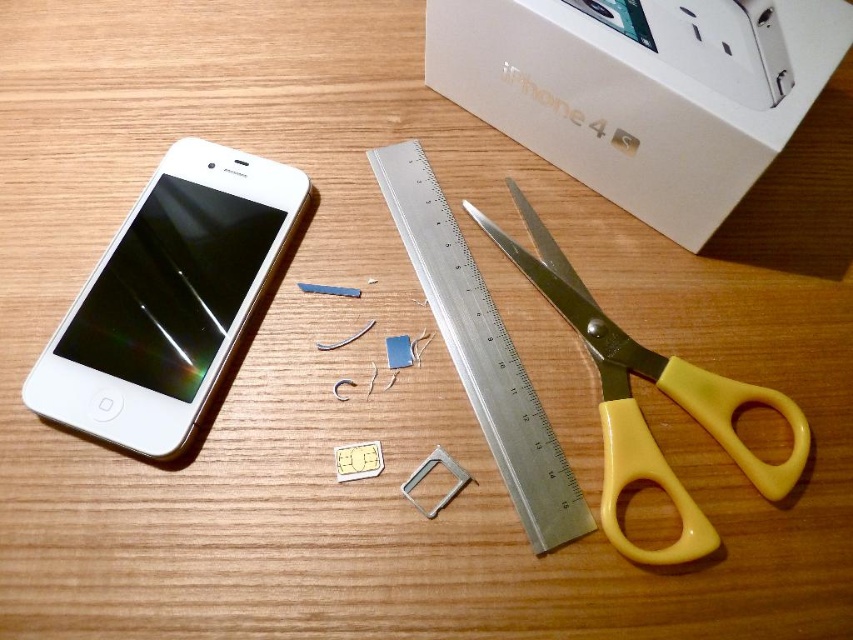
Is white matte smartphone at left below silver metallic ruler at center?

Actually, white matte smartphone at left is above silver metallic ruler at center.

Is point (194, 252) positioned before point (433, 246)?

Yes, it is.

Where is `white matte smartphone at left`? The image size is (853, 640). white matte smartphone at left is located at coordinates (167, 298).

Which of these two, white cardboard box at upper center or white matte smartphone at left, stands shorter?

With less height is white cardboard box at upper center.

Who is more forward, (682, 168) or (254, 218)?

Point (682, 168)

The image size is (853, 640). Describe the element at coordinates (642, 90) in the screenshot. I see `white cardboard box at upper center` at that location.

Identify the location of white cardboard box at upper center. This screenshot has width=853, height=640. (642, 90).

Between white cardboard box at upper center and silver metallic ruler at center, which one appears on the left side from the viewer's perspective?

Positioned to the left is silver metallic ruler at center.

Does white cardboard box at upper center have a smaller size compared to silver metallic ruler at center?

Actually, white cardboard box at upper center might be larger than silver metallic ruler at center.

Image resolution: width=853 pixels, height=640 pixels. Identify the location of white cardboard box at upper center. (642, 90).

The image size is (853, 640). Find the location of `white cardboard box at upper center`. white cardboard box at upper center is located at coordinates (642, 90).